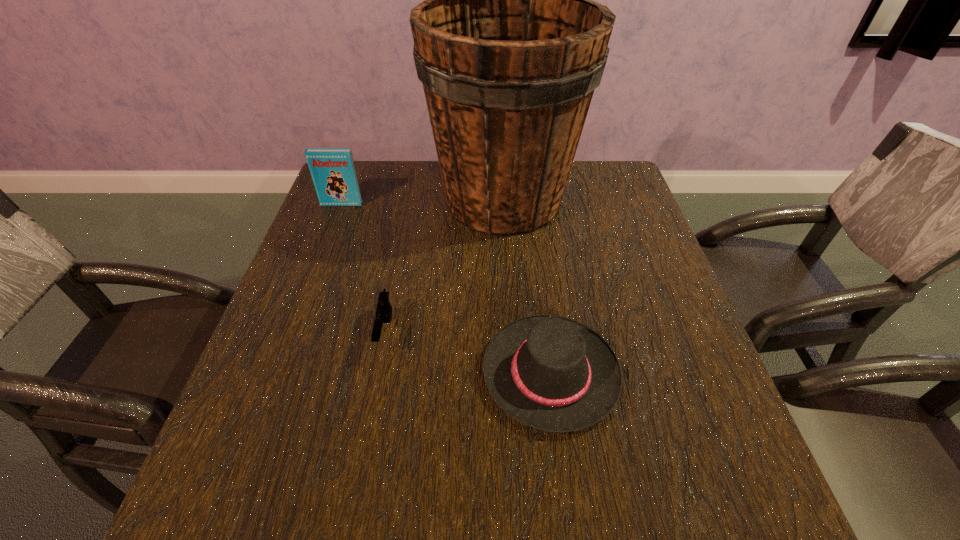
Identify which object is located as the third nearest to the shortest object. Please provide its 2D coordinates. Your answer should be formatted as a tuple, i.e. [(x, y)], where the tuple contains the x and y coordinates of a point satisfying the conditions above.

[(333, 172)]

Locate which object is the closest to the shortest object. Please provide its 2D coordinates. Your answer should be formatted as a tuple, i.e. [(x, y)], where the tuple contains the x and y coordinates of a point satisfying the conditions above.

[(509, 45)]

Image resolution: width=960 pixels, height=540 pixels. In order to click on vacant space that satisfies the following two spatial constraints: 1. on the front cover of the leftmost object; 2. on the left side of the third tallest object in this screenshot , I will do `click(278, 373)`.

This screenshot has height=540, width=960. In order to click on vacant point that satisfies the following two spatial constraints: 1. on the front-facing side of the second shortest object; 2. on the right side of the pistol in this screenshot , I will do `click(377, 373)`.

This screenshot has width=960, height=540. I want to click on blank area in the image that satisfies the following two spatial constraints: 1. on the front cover of the second shortest object; 2. on the right side of the book, so click(278, 373).